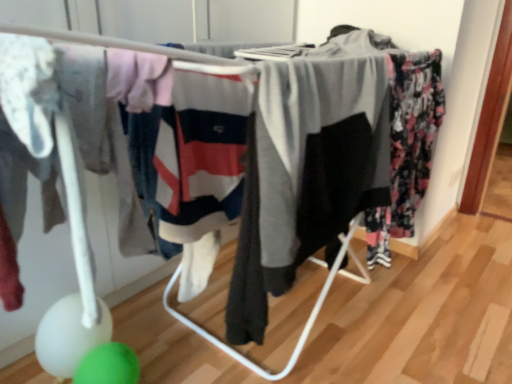
Question: Should I look upward or downward to see white glossy balloon at lower left?

Choices:
 (A) down
 (B) up

Answer: (A)